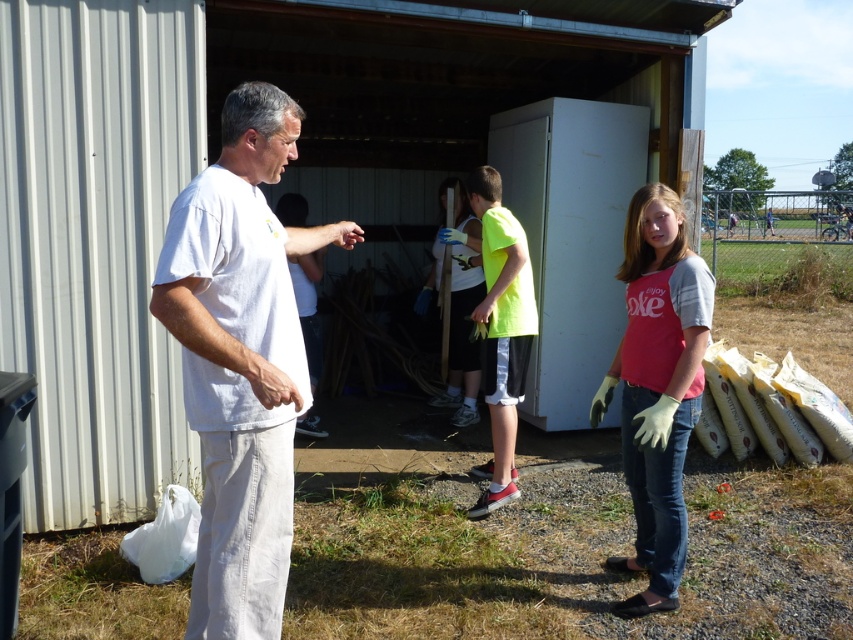
You are a photographer trying to capture a group photo of the volunteers. The white cotton shirt at left and the neon green jersey at center are two key figures. If you want to ensure both are in focus, which one should you adjust your camera focus on first considering their sizes?

The white cotton shirt at left is larger in size than the neon green jersey at center, so you should focus on the white cotton shirt at left first to ensure both are in focus.